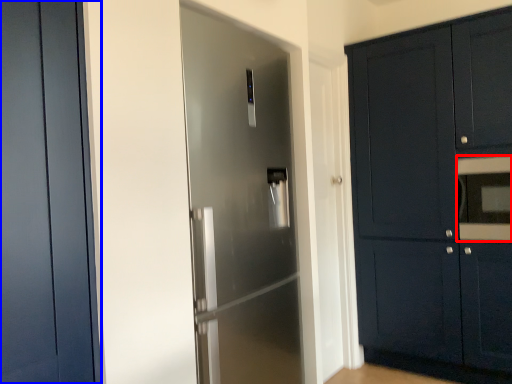
Question: Which object is closer to the camera taking this photo, oven (highlighted by a red box) or door (highlighted by a blue box)?

Choices:
 (A) oven
 (B) door

Answer: (B)